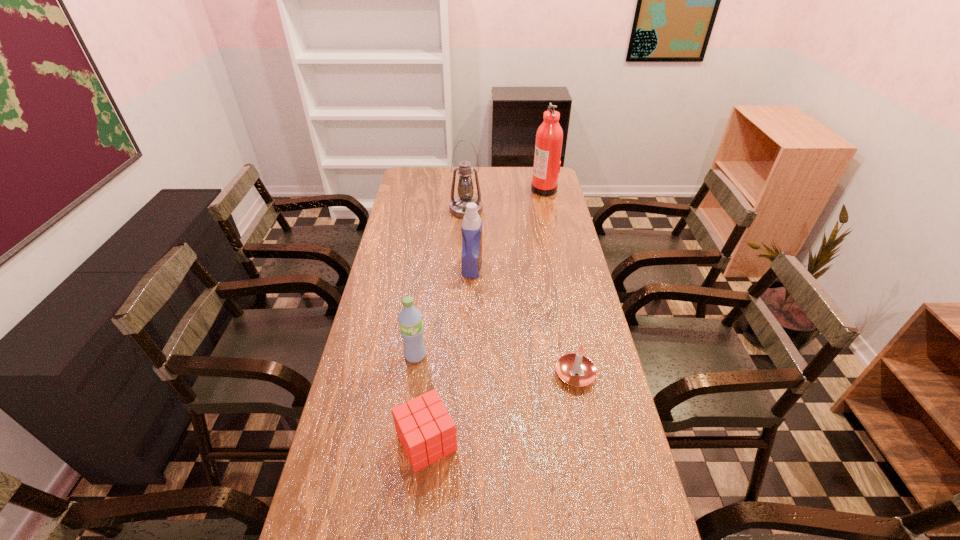
I want to click on free space located 0.200m on the label side of the fire extinguisher, so click(488, 189).

Image resolution: width=960 pixels, height=540 pixels. I want to click on vacant space located on the right of the fifth nearest object, so click(x=517, y=210).

The width and height of the screenshot is (960, 540). Find the location of `free region located 0.240m on the front of the fourth nearest object`. free region located 0.240m on the front of the fourth nearest object is located at coordinates (470, 329).

Find the location of a particular element. This screenshot has width=960, height=540. vacant area situated on the left of the water bottle is located at coordinates pos(365,355).

This screenshot has width=960, height=540. I want to click on free space located 0.380m on the left of the candle, so click(422, 374).

Locate an element on the screen. free space located on the right of the nearest object is located at coordinates (569, 442).

You are a GUI agent. You are given a task and a screenshot of the screen. Output one action in this format:
    pyautogui.click(x=<x>, y=<y>)
    Task: Click on the object that is at the far edge
    The width and height of the screenshot is (960, 540).
    Given the screenshot: What is the action you would take?
    pyautogui.click(x=549, y=137)

Identify the location of water bottle located in the left edge section of the desktop. (410, 321).

Identify the location of cube that is at the left edge. The width and height of the screenshot is (960, 540). [x=427, y=432].

At what (x,y) coordinates should I click in order to perform the action: click on fire extinguisher present at the right edge. Please return your answer as a coordinate pair (x, y). This screenshot has height=540, width=960. Looking at the image, I should click on click(x=549, y=137).